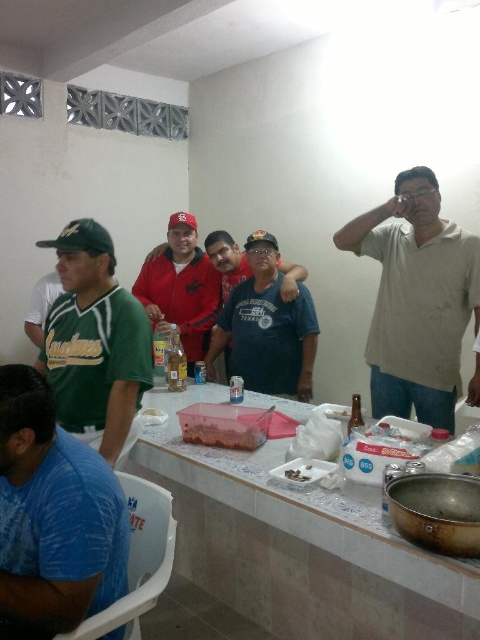
Can you confirm if green jersey at left is taller than white plastic bag at center?

Yes, green jersey at left is taller than white plastic bag at center.

Is green jersey at left to the right of white plastic bag at center from the viewer's perspective?

No, green jersey at left is not to the right of white plastic bag at center.

At what (x,y) coordinates should I click in order to perform the action: click on green jersey at left. Please return your answer as a coordinate pair (x, y). The width and height of the screenshot is (480, 640). Looking at the image, I should click on (95, 340).

The image size is (480, 640). I want to click on green jersey at left, so click(95, 340).

Is point (265, 611) closer to viewer compared to point (45, 410)?

No.

Can you confirm if white plastic table at center is taller than blue printed t-shirt at lower left?

Incorrect, white plastic table at center's height is not larger of blue printed t-shirt at lower left's.

Between point (324, 500) and point (113, 588), which one is positioned in front?

Point (113, 588) is in front.

Locate an element on the screen. This screenshot has height=640, width=480. white plastic table at center is located at coordinates (297, 545).

Does green jersey at left have a lesser width compared to translucent plastic container at center?

No, green jersey at left is not thinner than translucent plastic container at center.

Is point (118, 301) closer to camera compared to point (204, 428)?

Yes, it is in front of point (204, 428).

What do you see at coordinates (95, 340) in the screenshot?
I see `green jersey at left` at bounding box center [95, 340].

I want to click on green jersey at left, so click(95, 340).